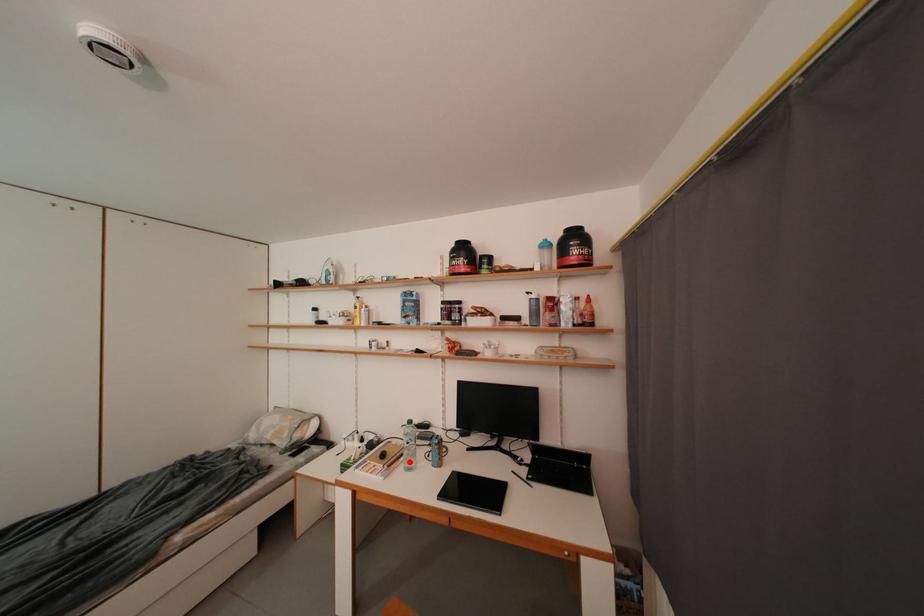
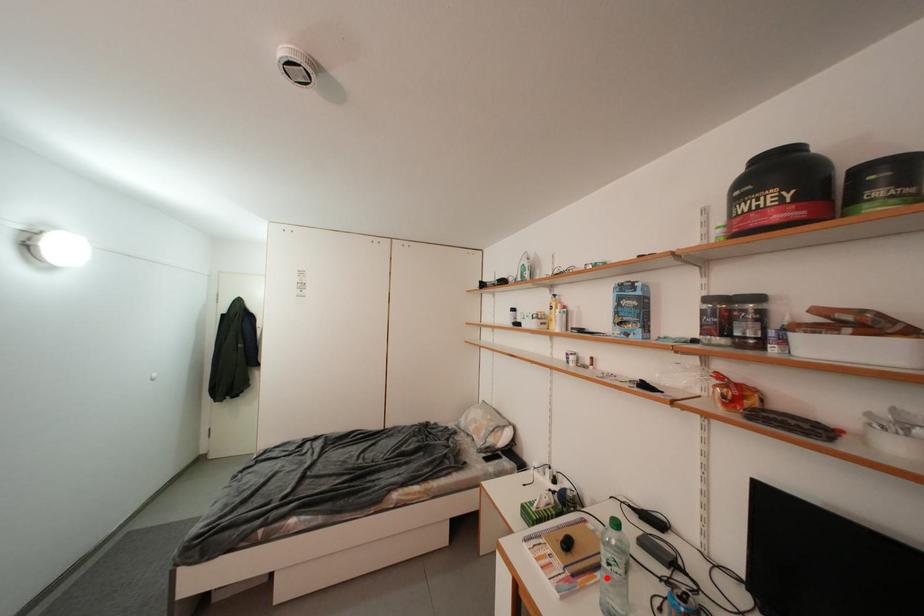
I am providing you with two images of the same scene from different viewpoints. A red point is marked on the first image and another point is marked on the second image. Is the marked point in image1 the same physical position as the marked point in image2?

Yes